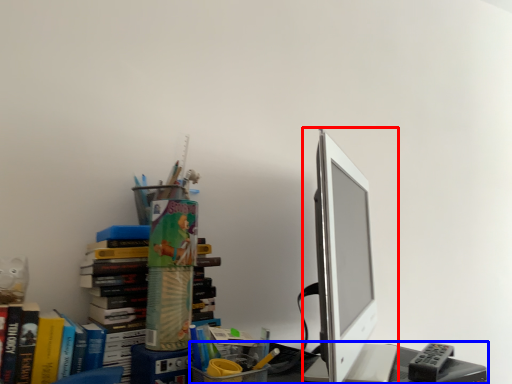
Question: Which of the following is the closest to the observer, computer monitor (highlighted by a red box) or desk (highlighted by a blue box)?

Choices:
 (A) computer monitor
 (B) desk

Answer: (A)